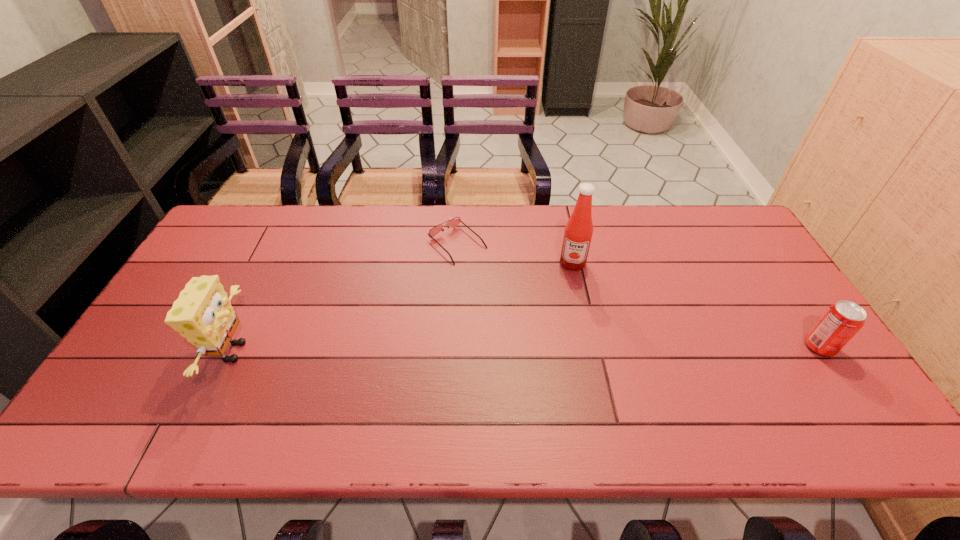
This screenshot has height=540, width=960. In order to click on vacant space on the desktop that is between the sponge and the rightmost object and is positioned on the bridge of the shortest object in this screenshot , I will do `click(574, 349)`.

Where is `free space on the desktop that is between the sponge and the third tallest object and is positioned on the front-facing side of the tallest object`? This screenshot has width=960, height=540. free space on the desktop that is between the sponge and the third tallest object and is positioned on the front-facing side of the tallest object is located at coordinates (558, 349).